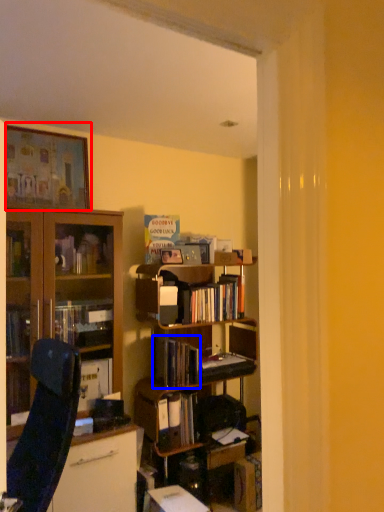
Question: Which object is closer to the camera taking this photo, picture frame (highlighted by a red box) or book (highlighted by a blue box)?

Choices:
 (A) picture frame
 (B) book

Answer: (A)